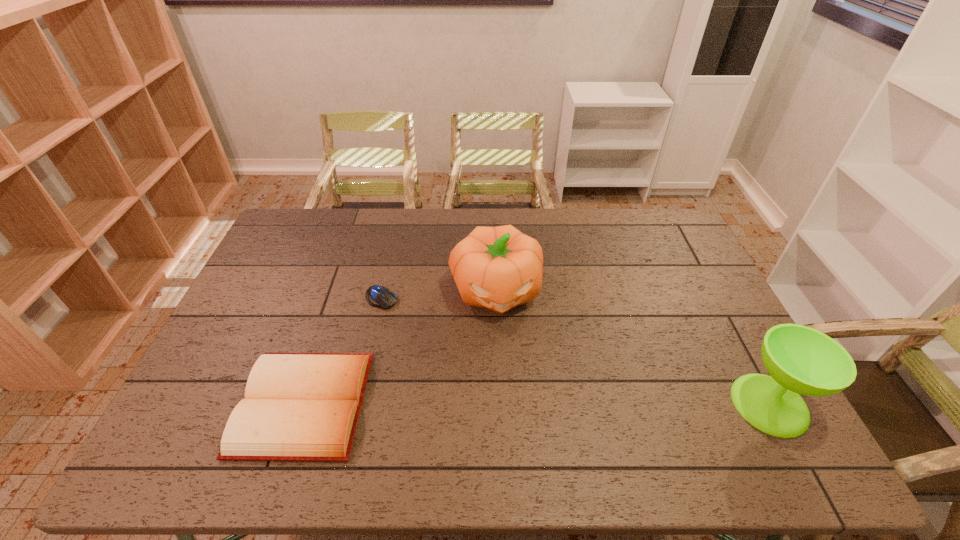
At what (x,y) coordinates should I click in order to perform the action: click on vacant space on the desktop that is between the third tallest object and the rightmost object and is positioned on the button side of the shortest object. Please return your answer as a coordinate pair (x, y). Image resolution: width=960 pixels, height=540 pixels. Looking at the image, I should click on (517, 404).

At what (x,y) coordinates should I click in order to perform the action: click on free space on the desktop that is between the Bible and the wineglass and is positioned on the carved face of the third object from left to right. Please return your answer as a coordinate pair (x, y). Image resolution: width=960 pixels, height=540 pixels. Looking at the image, I should click on (514, 404).